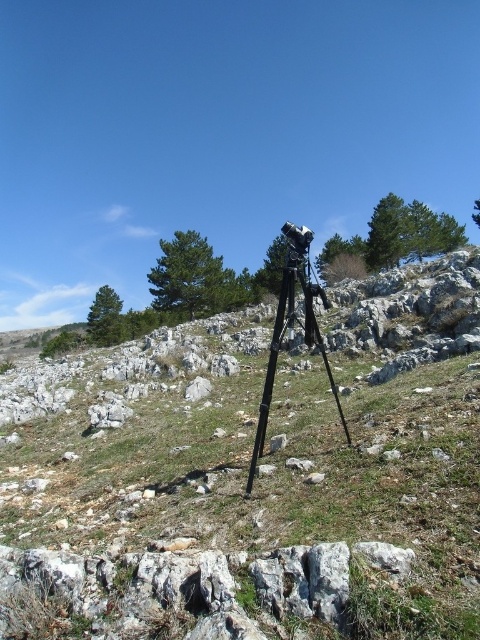
You are standing at the point labeled point (29, 449) and want to walk to the point labeled point (331, 387). Based on the terrain described, will you be walking uphill or downhill?

Since point (29, 449) is closer to the viewer than point (331, 387), and the camera is positioned on a grassy slope angled upwards, you would be walking uphill towards the point (331, 387).